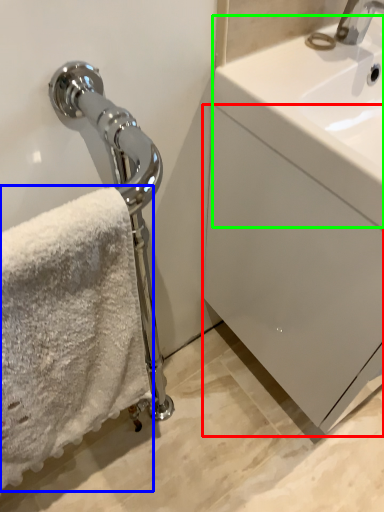
Question: Estimate the real-world distances between objects in this image. Which object is closer to drawer (highlighted by a red box), towel (highlighted by a blue box) or counter top (highlighted by a green box)?

Choices:
 (A) towel
 (B) counter top

Answer: (B)